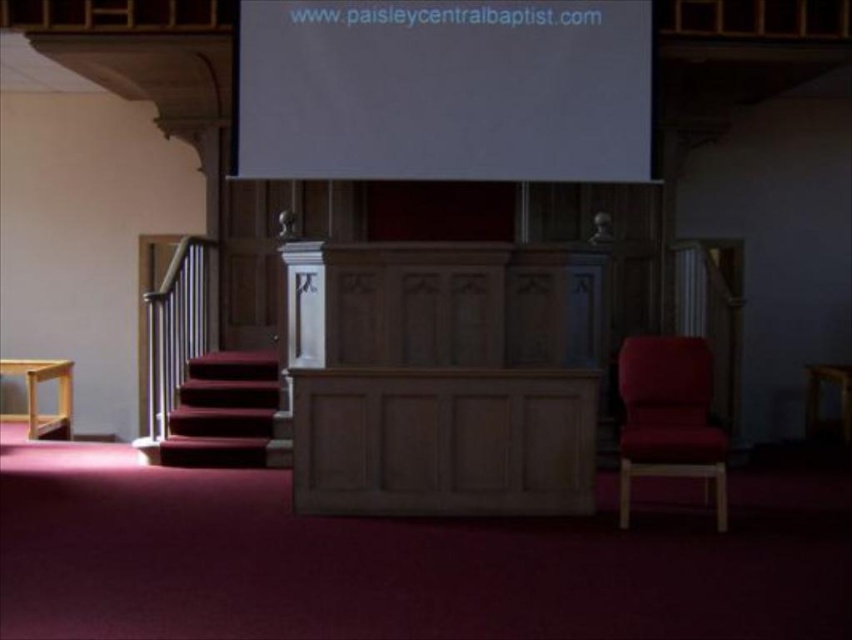
You are an event planner setting up for a presentation in the church. You need to position a 3m wide banner between the white matte projection screen at upper center and the velvet red armchair at right. Can you fit it horizontally without overlapping either object?

The white matte projection screen at upper center is to the left of the velvet red armchair at right, so the distance between them must be at least 3 meters for the banner to fit horizontally. However, since the exact distance isn not provided, we cannot confirm if it will fit without overlapping.